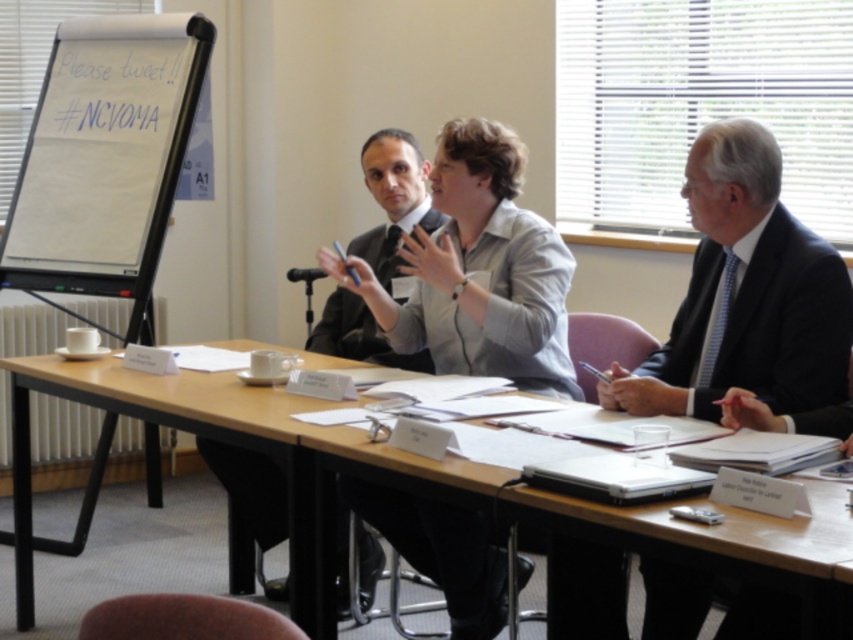
You are sitting at the back of the conference room and want to place a document on the light brown wood table at center. However, there is a dark gray suit at center in the way. Can you reach the table without moving the suit?

The light brown wood table at center is closer to the viewer than the dark gray suit at center, so you can reach the table without moving the dark gray suit at center because it is closer to you.

From the picture: You are a photographer in the conference room and want to take a photo of the light gray shirt at center and dark gray suit at center such that both are clearly visible. Based on their positions, which one should you focus on first to ensure both are in focus?

The light gray shirt at center is in front of the dark gray suit at center, so you should focus on the light gray shirt at center first to ensure both are in focus.